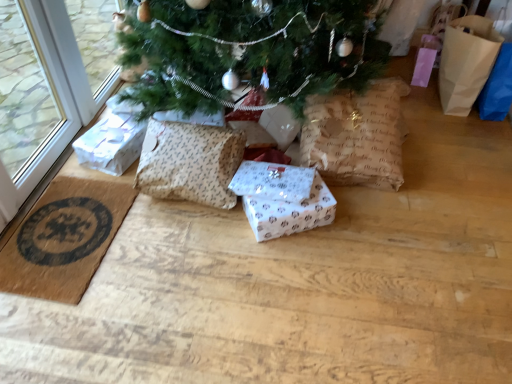
What is the approximate height of patterned fabric pillow at center?

patterned fabric pillow at center is 11.40 inches tall.

What are the coordinates of `patterned fabric pillow at center` in the screenshot? It's located at (190, 162).

I want to click on white paper gift at left, arranged as the third gift box when viewed from the right, so click(x=112, y=140).

What is the approximate width of brown woven mat at lower left?

15.78 inches.

Where is `white paper gift box at center, the 3th gift box viewed from the left`? The height and width of the screenshot is (384, 512). white paper gift box at center, the 3th gift box viewed from the left is located at coordinates (290, 212).

Is brown paper bag at center smaller than brown woven mat at lower left?

No, brown paper bag at center is not smaller than brown woven mat at lower left.

From a real-world perspective, is brown paper bag at center over brown woven mat at lower left?

Correct, in the physical world, brown paper bag at center is higher than brown woven mat at lower left.

Does brown paper bag at center have a greater height compared to brown woven mat at lower left?

Yes, brown paper bag at center is taller than brown woven mat at lower left.

How much distance is there between brown paper bag at center and brown woven mat at lower left?

1.04 meters.

From the image's perspective, which object appears higher, white paper gift at left, arranged as the third gift box when viewed from the right, or white paper gift at center, arranged as the 2th gift box when viewed from the right?

white paper gift at left, arranged as the third gift box when viewed from the right.

Looking at this image, is white paper gift at left, placed as the 1th gift box when sorted from left to right, positioned with its back to white paper gift at center, which appears as the second gift box when viewed from the left?

No, white paper gift at center, which appears as the second gift box when viewed from the left, is not at the back of white paper gift at left, placed as the 1th gift box when sorted from left to right.

Which is more to the left, white paper gift at left, arranged as the third gift box when viewed from the right, or white paper gift at center, arranged as the 2th gift box when viewed from the right?

From the viewer's perspective, white paper gift at left, arranged as the third gift box when viewed from the right, appears more on the left side.

Is white paper gift at left, arranged as the third gift box when viewed from the right, next to white paper gift box at center, the 3th gift box viewed from the left?

No, white paper gift at left, arranged as the third gift box when viewed from the right, is not in contact with white paper gift box at center, the 3th gift box viewed from the left.

From a real-world perspective, is white paper gift at left, arranged as the third gift box when viewed from the right, above or below white paper gift box at center, the 3th gift box viewed from the left?

white paper gift at left, arranged as the third gift box when viewed from the right, is above white paper gift box at center, the 3th gift box viewed from the left.

Considering the positions of objects white paper gift at left, arranged as the third gift box when viewed from the right, and white paper gift box at center, the 3th gift box viewed from the left, in the image provided, who is more to the right, white paper gift at left, arranged as the third gift box when viewed from the right, or white paper gift box at center, the 3th gift box viewed from the left,?

From the viewer's perspective, white paper gift box at center, the 3th gift box viewed from the left, appears more on the right side.

Between point (131, 156) and point (331, 217), which one is positioned behind?

The point (131, 156) is farther.

Is white paper gift at left, placed as the 1th gift box when sorted from left to right, outside of patterned fabric pillow at center?

white paper gift at left, placed as the 1th gift box when sorted from left to right, lies outside patterned fabric pillow at center's area.

Between white paper gift at left, placed as the 1th gift box when sorted from left to right, and patterned fabric pillow at center, which one has smaller size?

With smaller size is white paper gift at left, placed as the 1th gift box when sorted from left to right.

You are a GUI agent. You are given a task and a screenshot of the screen. Output one action in this format:
    pyautogui.click(x=<x>, y=<y>)
    Task: Click on the pillow in front of the white paper gift at left, placed as the 1th gift box when sorted from left to right
    The height and width of the screenshot is (384, 512).
    Given the screenshot: What is the action you would take?
    pyautogui.click(x=190, y=162)

From the image's perspective, which is above, patterned fabric pillow at center or white paper gift box at center, which is the 1th gift box from right to left?

patterned fabric pillow at center, from the image's perspective.

From a real-world perspective, count 2nd gift boxs downward from the patterned fabric pillow at center and point to it. Please provide its 2D coordinates.

[(290, 212)]

Considering the sizes of patterned fabric pillow at center and white paper gift box at center, which is the 1th gift box from right to left, in the image, is patterned fabric pillow at center bigger or smaller than white paper gift box at center, which is the 1th gift box from right to left,?

Considering their sizes, patterned fabric pillow at center takes up more space than white paper gift box at center, which is the 1th gift box from right to left.

From a real-world perspective, is patterned fabric pillow at center above or below white paper gift box at center, the 3th gift box viewed from the left?

Clearly, from a real-world perspective, patterned fabric pillow at center is above white paper gift box at center, the 3th gift box viewed from the left.

Is white paper gift at left, placed as the 1th gift box when sorted from left to right, beside brown paper bag at center?

No, white paper gift at left, placed as the 1th gift box when sorted from left to right, is not making contact with brown paper bag at center.

Looking at this image, is white paper gift at left, placed as the 1th gift box when sorted from left to right, taller or shorter than brown paper bag at center?

Considering their sizes, white paper gift at left, placed as the 1th gift box when sorted from left to right, has less height than brown paper bag at center.

Which is less distant, (83, 165) or (357, 134)?

The point (357, 134) is closer to the camera.

From the image's perspective, is white paper gift at left, arranged as the third gift box when viewed from the right, located above or below brown paper bag at center?

Based on their image positions, white paper gift at left, arranged as the third gift box when viewed from the right, is located beneath brown paper bag at center.

Can you confirm if white paper gift at center, which appears as the second gift box when viewed from the left, is taller than patterned fabric pillow at center?

No.

Are white paper gift at center, arranged as the 2th gift box when viewed from the right, and patterned fabric pillow at center making contact?

white paper gift at center, arranged as the 2th gift box when viewed from the right, and patterned fabric pillow at center are clearly separated.

In order to click on pillow below the white paper gift at center, arranged as the 2th gift box when viewed from the right (from a real-world perspective) in this screenshot , I will do `click(190, 162)`.

The height and width of the screenshot is (384, 512). What are the coordinates of `shopping bag that appears above the brown woven mat at lower left (from the image's perspective)` in the screenshot? It's located at (357, 136).

Where is `gift box above the white paper gift at left, placed as the 1th gift box when sorted from left to right (from a real-world perspective)`? gift box above the white paper gift at left, placed as the 1th gift box when sorted from left to right (from a real-world perspective) is located at coordinates (273, 181).

From the image, which object appears to be nearer to patterned fabric pillow at center, brown woven mat at lower left or brown paper bag at center?

Among the two, brown woven mat at lower left is located nearer to patterned fabric pillow at center.

Estimate the real-world distances between objects in this image. Which object is closer to patterned fabric pillow at center, brown paper bag at right or brown woven mat at lower left?

brown woven mat at lower left is closer to patterned fabric pillow at center.

From the image, which object appears to be nearer to white paper gift at center, which appears as the second gift box when viewed from the left, white paper gift box at center, the 3th gift box viewed from the left, or brown paper bag at right?

white paper gift box at center, the 3th gift box viewed from the left, is positioned closer to the anchor white paper gift at center, which appears as the second gift box when viewed from the left.

Looking at the image, which one is located closer to white paper gift box at center, the 3th gift box viewed from the left, brown paper bag at center or white paper gift at center, which appears as the second gift box when viewed from the left?

white paper gift at center, which appears as the second gift box when viewed from the left, is closer to white paper gift box at center, the 3th gift box viewed from the left.

When comparing their distances from brown woven mat at lower left, does patterned fabric pillow at center or white paper gift at center, which appears as the second gift box when viewed from the left, seem further?

white paper gift at center, which appears as the second gift box when viewed from the left, is further to brown woven mat at lower left.

Based on their spatial positions, is white paper gift at center, which appears as the second gift box when viewed from the left, or white paper gift at left, arranged as the third gift box when viewed from the right, closer to brown woven mat at lower left?

The object closer to brown woven mat at lower left is white paper gift at left, arranged as the third gift box when viewed from the right.

Based on the photo, estimate the real-world distances between objects in this image. Which object is further from patterned fabric pillow at center, brown paper bag at center or brown paper bag at right?

brown paper bag at right.

Looking at the image, which one is located closer to brown woven mat at lower left, white paper gift box at center, the 3th gift box viewed from the left, or white paper gift at center, arranged as the 2th gift box when viewed from the right?

white paper gift at center, arranged as the 2th gift box when viewed from the right, is closer to brown woven mat at lower left.

You are a GUI agent. You are given a task and a screenshot of the screen. Output one action in this format:
    pyautogui.click(x=<x>, y=<y>)
    Task: Click on the shopping bag between white paper gift at center, arranged as the 2th gift box when viewed from the right, and brown paper bag at right
    The height and width of the screenshot is (384, 512).
    Given the screenshot: What is the action you would take?
    pyautogui.click(x=357, y=136)

The image size is (512, 384). I want to click on pillow between brown woven mat at lower left and white paper gift at center, arranged as the 2th gift box when viewed from the right, from left to right, so click(x=190, y=162).

Image resolution: width=512 pixels, height=384 pixels. In order to click on shopping bag located between patterned fabric pillow at center and brown paper bag at right in the left-right direction in this screenshot , I will do `click(357, 136)`.

Find the location of `gift box between brown woven mat at lower left and white paper gift at center, which appears as the second gift box when viewed from the left`. gift box between brown woven mat at lower left and white paper gift at center, which appears as the second gift box when viewed from the left is located at coordinates (112, 140).